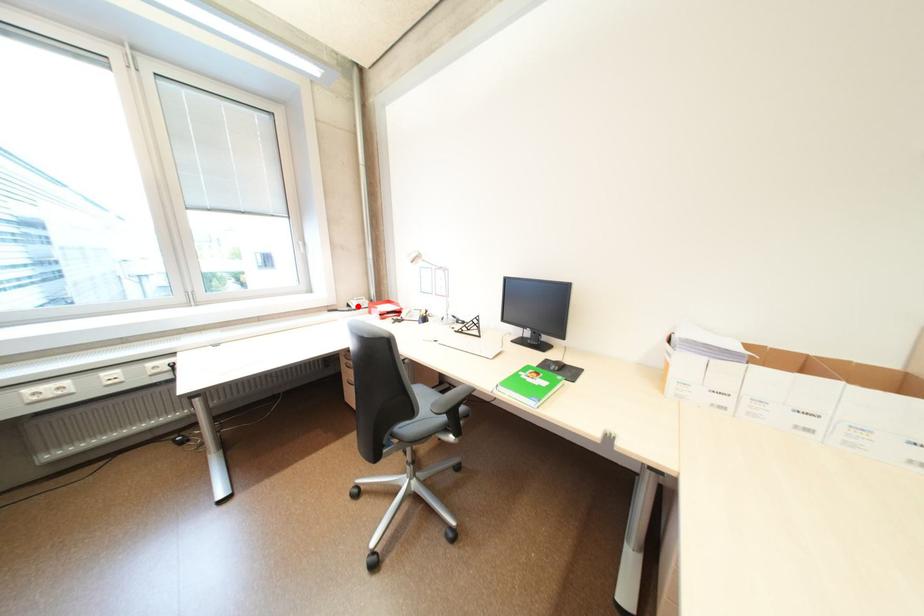
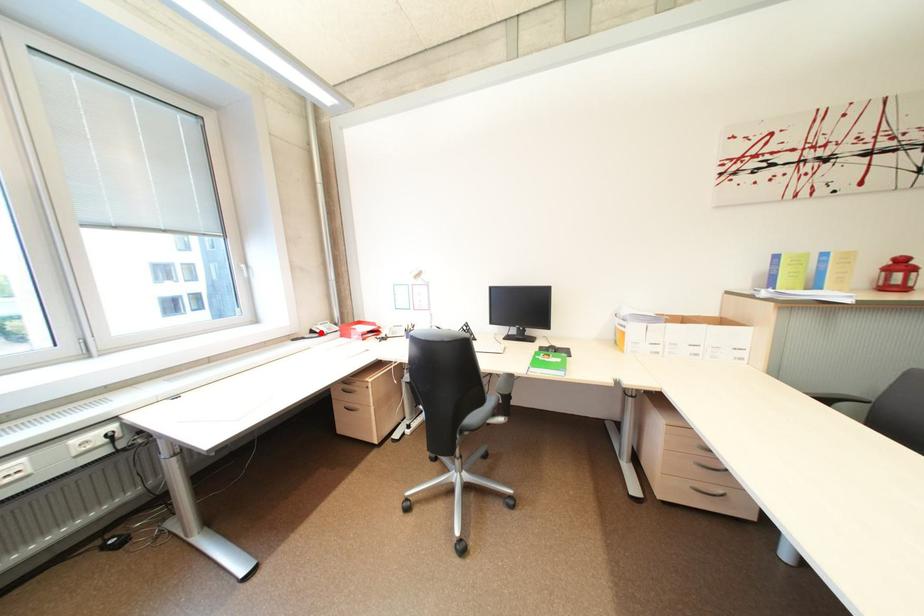
I am providing you with two images of the same scene from different viewpoints. A red point is marked on the first image and another point is marked on the second image. Are the points marked in image1 and image2 representing the same 3D position?

Yes